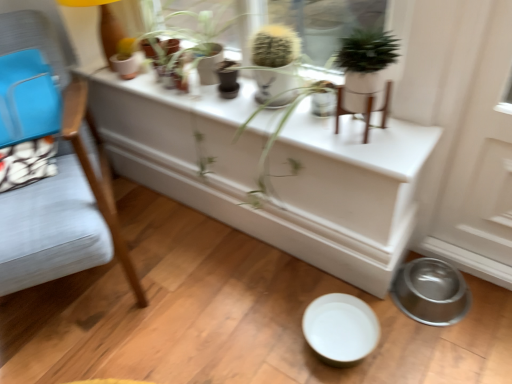
Question: Is green matte plant at upper center, arranged as the second houseplant when viewed from the left, positioned in front of metallic silver bowl at lower right?

Choices:
 (A) yes
 (B) no

Answer: (A)

Question: From the image's perspective, is green matte plant at upper center, which appears as the 2th houseplant when viewed from the back, below metallic silver bowl at lower right?

Choices:
 (A) yes
 (B) no

Answer: (B)

Question: Is green matte plant at upper center, which appears as the 2th houseplant when viewed from the back, aimed at metallic silver bowl at lower right?

Choices:
 (A) no
 (B) yes

Answer: (A)

Question: Is green matte plant at upper center, arranged as the second houseplant when viewed from the left, smaller than metallic silver bowl at lower right?

Choices:
 (A) no
 (B) yes

Answer: (B)

Question: From a real-world perspective, is green matte plant at upper center, which appears as the first houseplant when viewed from the right, over metallic silver bowl at lower right?

Choices:
 (A) no
 (B) yes

Answer: (B)

Question: From the image's perspective, does green matte plant at upper center, the first houseplant viewed from the front, appear higher than metallic silver bowl at lower right?

Choices:
 (A) yes
 (B) no

Answer: (A)

Question: From a real-world perspective, does metallic silver bowl at lower right sit lower than fuzzy green cactus at upper center, which is the second houseplant in right-to-left order?

Choices:
 (A) no
 (B) yes

Answer: (B)

Question: Is metallic silver bowl at lower right thinner than fuzzy green cactus at upper center, the second houseplant from the front?

Choices:
 (A) yes
 (B) no

Answer: (B)

Question: Is metallic silver bowl at lower right to the left of fuzzy green cactus at upper center, the second houseplant from the front, from the viewer's perspective?

Choices:
 (A) no
 (B) yes

Answer: (A)

Question: Can you confirm if metallic silver bowl at lower right is taller than fuzzy green cactus at upper center, which is the 1th houseplant from back to front?

Choices:
 (A) no
 (B) yes

Answer: (A)

Question: Is fuzzy green cactus at upper center, which is the 1th houseplant from back to front, located within metallic silver bowl at lower right?

Choices:
 (A) no
 (B) yes

Answer: (A)

Question: From a real-world perspective, is metallic silver bowl at lower right over fuzzy green cactus at upper center, the second houseplant from the front?

Choices:
 (A) yes
 (B) no

Answer: (B)

Question: Would you say green matte plant at upper center, which appears as the first houseplant when viewed from the right, contains matte white flowerpot at upper left?

Choices:
 (A) yes
 (B) no

Answer: (B)